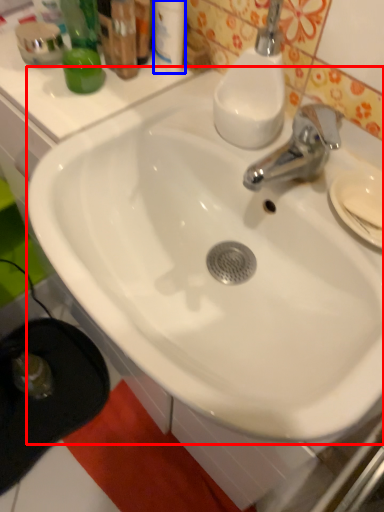
Question: Which point is further to the camera, sink (highlighted by a red box) or toiletry (highlighted by a blue box)?

Choices:
 (A) sink
 (B) toiletry

Answer: (B)